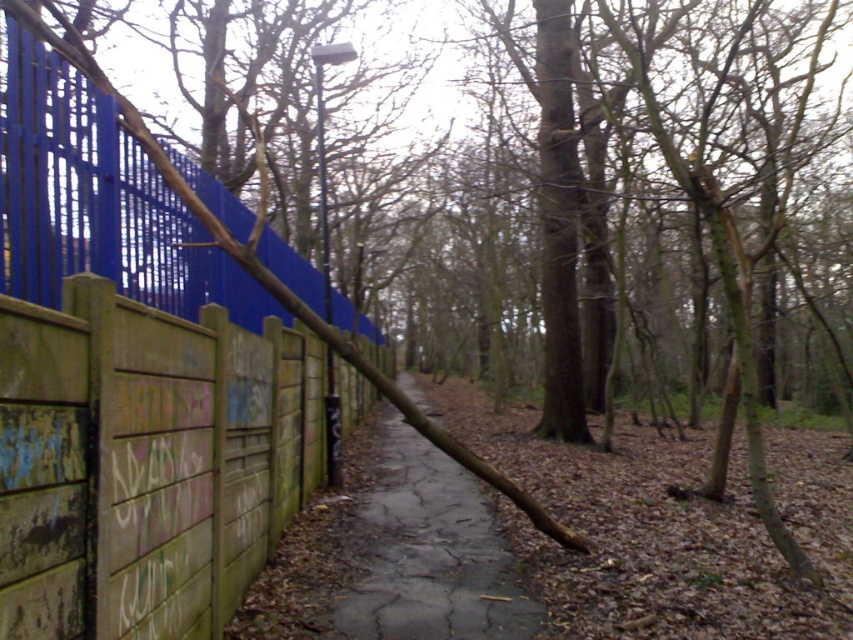
Question: Which point is farther from the camera taking this photo?

Choices:
 (A) [460, 582]
 (B) [177, 433]

Answer: (A)

Question: Which point is closer to the camera?

Choices:
 (A) wooden fence with graffiti at left
 (B) brown cracked pavement at center

Answer: (A)

Question: Does wooden fence with graffiti at left appear on the right side of brown cracked pavement at center?

Choices:
 (A) no
 (B) yes

Answer: (A)

Question: Which point is farther from the camera taking this photo?

Choices:
 (A) (44, 404)
 (B) (422, 538)

Answer: (B)

Question: Is wooden fence with graffiti at left bigger than brown cracked pavement at center?

Choices:
 (A) no
 (B) yes

Answer: (A)

Question: Is wooden fence with graffiti at left above brown cracked pavement at center?

Choices:
 (A) yes
 (B) no

Answer: (A)